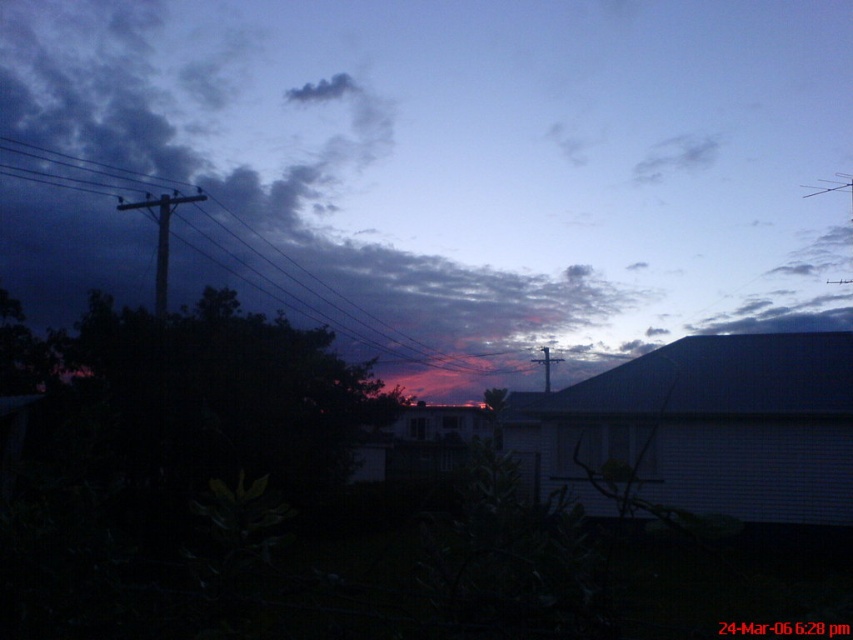
In the scene shown: Who is shorter, matte dark blue sky at upper center or smooth wooden telegraph pole at left?

smooth wooden telegraph pole at left

Is point (723, 320) positioned after point (167, 220)?

Yes.

Find the location of a particular element. Image resolution: width=853 pixels, height=640 pixels. matte dark blue sky at upper center is located at coordinates (440, 168).

Image resolution: width=853 pixels, height=640 pixels. In order to click on smooth wooden telegraph pole at left in this screenshot , I will do `click(161, 237)`.

Which of these two, smooth wooden telegraph pole at left or metallic wire at center, stands shorter?

Standing shorter between the two is metallic wire at center.

Which is in front, point (163, 204) or point (532, 362)?

Point (163, 204) is more forward.

You are a GUI agent. You are given a task and a screenshot of the screen. Output one action in this format:
    pyautogui.click(x=<x>, y=<y>)
    Task: Click on the smooth wooden telegraph pole at left
    This screenshot has width=853, height=640.
    Given the screenshot: What is the action you would take?
    pyautogui.click(x=161, y=237)

Is matte dark blue sky at upper center wider than metallic wire at center?

Correct, the width of matte dark blue sky at upper center exceeds that of metallic wire at center.

Is matte dark blue sky at upper center above metallic wire at center?

Yes.

Who is more forward, (x=532, y=144) or (x=543, y=356)?

Point (x=543, y=356)

At what (x,y) coordinates should I click in order to perform the action: click on matte dark blue sky at upper center. Please return your answer as a coordinate pair (x, y). Image resolution: width=853 pixels, height=640 pixels. Looking at the image, I should click on (440, 168).